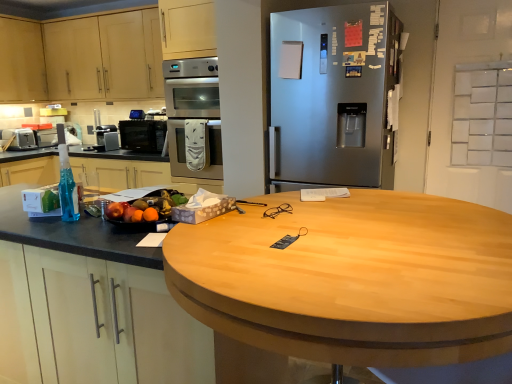
Question: Is translucent blue liquid at left far away from glossy plastic fruit bowl at left?

Choices:
 (A) no
 (B) yes

Answer: (A)

Question: Is translucent blue liquid at left in front of glossy plastic fruit bowl at left?

Choices:
 (A) no
 (B) yes

Answer: (B)

Question: Is translucent blue liquid at left facing away from glossy plastic fruit bowl at left?

Choices:
 (A) no
 (B) yes

Answer: (A)

Question: Does translucent blue liquid at left appear on the right side of glossy plastic fruit bowl at left?

Choices:
 (A) yes
 (B) no

Answer: (B)

Question: Can you confirm if translucent blue liquid at left is shorter than glossy plastic fruit bowl at left?

Choices:
 (A) no
 (B) yes

Answer: (A)

Question: Looking at their shapes, would you say wooden at left is wider or thinner than matte black microwave at center?

Choices:
 (A) thin
 (B) wide

Answer: (B)

Question: Would you say wooden at left is inside or outside matte black microwave at center?

Choices:
 (A) outside
 (B) inside

Answer: (A)

Question: From a real-world perspective, is wooden at left physically located above or below matte black microwave at center?

Choices:
 (A) above
 (B) below

Answer: (B)

Question: In the image, is wooden at left positioned in front of or behind matte black microwave at center?

Choices:
 (A) front
 (B) behind

Answer: (A)

Question: Looking at their shapes, would you say wooden at left is wider or thinner than matte wood cabinet at upper left, which is counted as the first cabinetry, starting from the left?

Choices:
 (A) thin
 (B) wide

Answer: (B)

Question: From a real-world perspective, is wooden at left above or below matte wood cabinet at upper left, which is counted as the first cabinetry, starting from the left?

Choices:
 (A) below
 (B) above

Answer: (A)

Question: Considering the relative positions of wooden at left and matte wood cabinet at upper left, which is counted as the first cabinetry, starting from the left, in the image provided, is wooden at left to the left or to the right of matte wood cabinet at upper left, which is counted as the first cabinetry, starting from the left,?

Choices:
 (A) right
 (B) left

Answer: (A)

Question: Considering their positions, is wooden at left located in front of or behind matte wood cabinet at upper left, which is counted as the first cabinetry, starting from the left?

Choices:
 (A) behind
 (B) front

Answer: (B)

Question: Is satin silver coffee maker at center, which is counted as the 1th appliance, starting from the right, wider or thinner than light wood cabinet at upper left, the first cabinetry positioned from the right?

Choices:
 (A) wide
 (B) thin

Answer: (B)

Question: Is satin silver coffee maker at center, which is counted as the 1th appliance, starting from the right, bigger or smaller than light wood cabinet at upper left, acting as the 2th cabinetry starting from the left?

Choices:
 (A) small
 (B) big

Answer: (A)